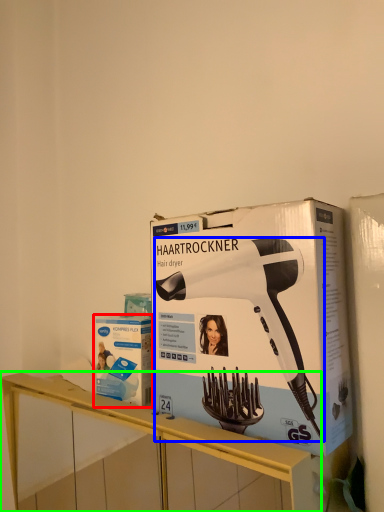
Question: Which is farther away from box (highlighted by a red box)? hair drier (highlighted by a blue box) or furniture (highlighted by a green box)?

Choices:
 (A) hair drier
 (B) furniture

Answer: (A)